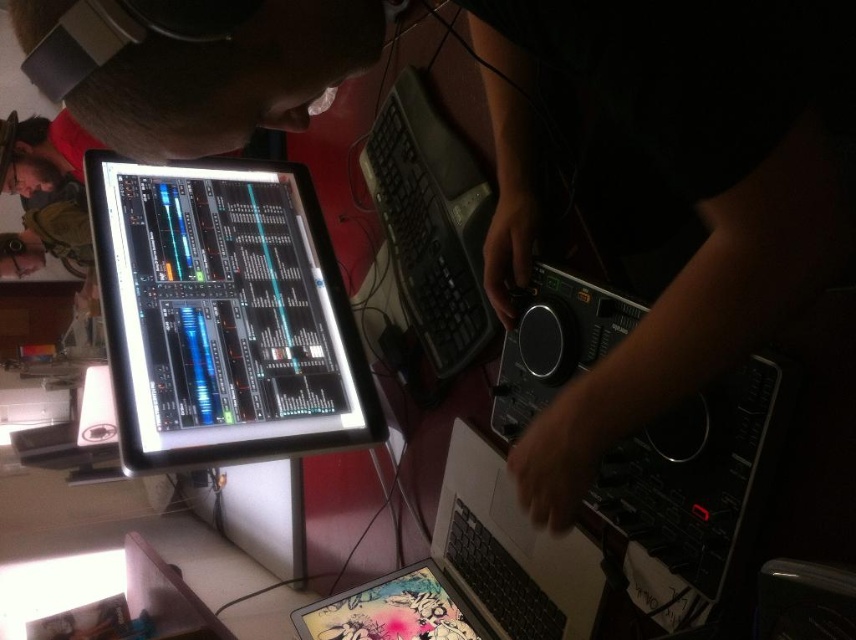
Question: Does metallic silver laptop at lower center have a greater width compared to matte plastic tablet at lower center?

Choices:
 (A) yes
 (B) no

Answer: (A)

Question: Which point is closer to the camera?

Choices:
 (A) (207, 442)
 (B) (450, 218)
 (C) (471, 632)
 (D) (301, 627)

Answer: (A)

Question: Which of the following is the closest to the observer?

Choices:
 (A) (419, 561)
 (B) (220, 428)

Answer: (B)

Question: Can you confirm if metallic silver laptop at lower center is positioned above matte plastic tablet at lower center?

Choices:
 (A) no
 (B) yes

Answer: (B)

Question: Which of the following is the farthest from the observer?

Choices:
 (A) matte plastic tablet at lower center
 (B) black plastic keyboard at center
 (C) metallic silver laptop at lower center

Answer: (A)

Question: Is matte black monitor at upper left above metallic silver laptop at lower center?

Choices:
 (A) no
 (B) yes

Answer: (B)